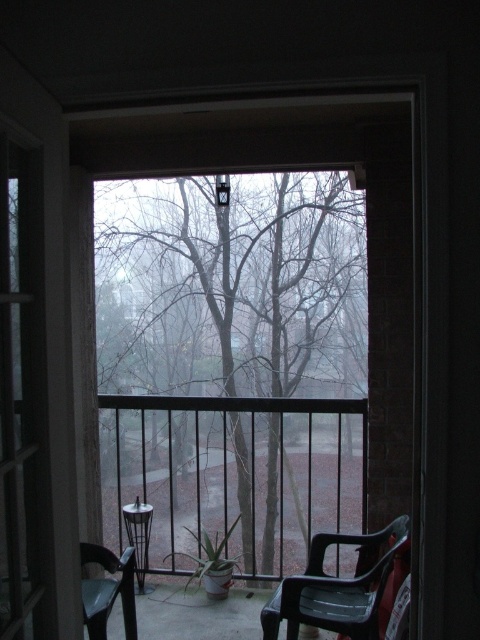
You are trying to decide whether to place a new decorative item on the transparent plastic screen door at left or the translucent plastic chair at lower right. Based on their widths, which surface can accommodate a wider object?

The translucent plastic chair at lower right is wider than the transparent plastic screen door at left, so it can accommodate a wider object.